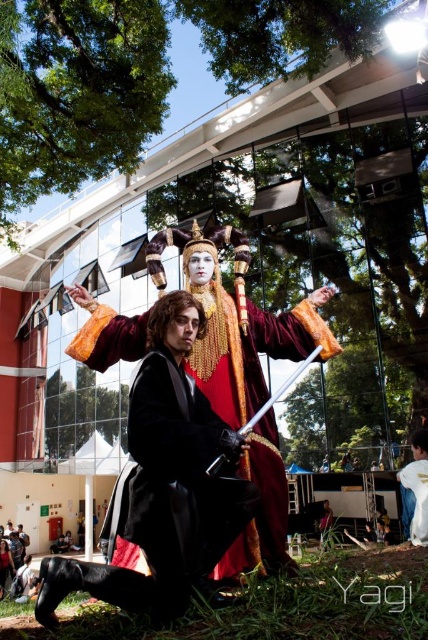
Question: Which is farther from the matte black dress at lower left?

Choices:
 (A) velvet maroon cape at center
 (B) white matte shirt at lower right

Answer: (A)

Question: Can you confirm if velvet maroon cape at center is thinner than white matte shirt at lower right?

Choices:
 (A) yes
 (B) no

Answer: (A)

Question: Which point is closer to the camera?

Choices:
 (A) matte black dress at lower left
 (B) velvet maroon cape at center

Answer: (B)

Question: Which of these objects is positioned closest to the white matte shirt at lower right?

Choices:
 (A) velvet maroon cape at center
 (B) matte black dress at lower left

Answer: (A)

Question: Is white matte shirt at lower right to the right of matte black dress at lower left from the viewer's perspective?

Choices:
 (A) yes
 (B) no

Answer: (A)

Question: Can you confirm if white matte shirt at lower right is smaller than matte black dress at lower left?

Choices:
 (A) yes
 (B) no

Answer: (B)